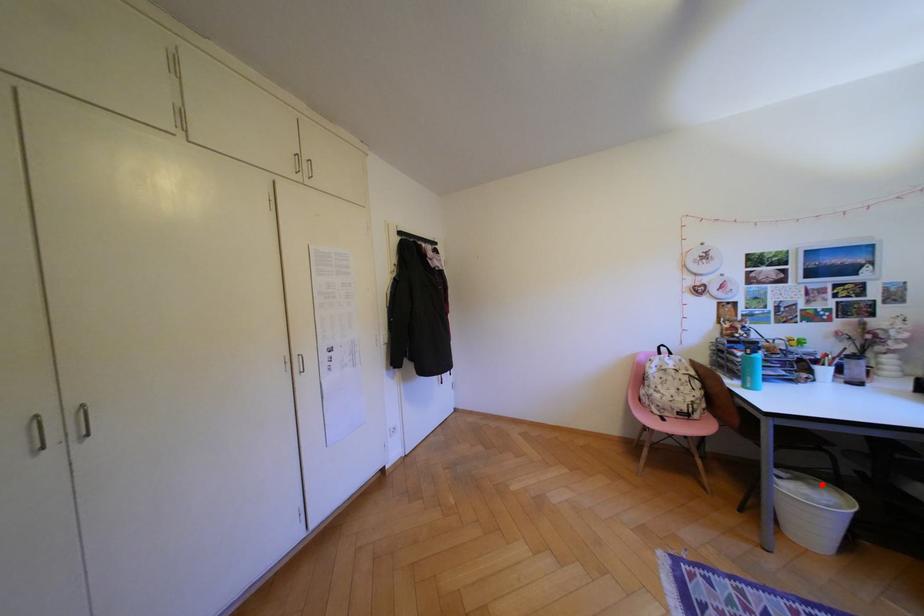
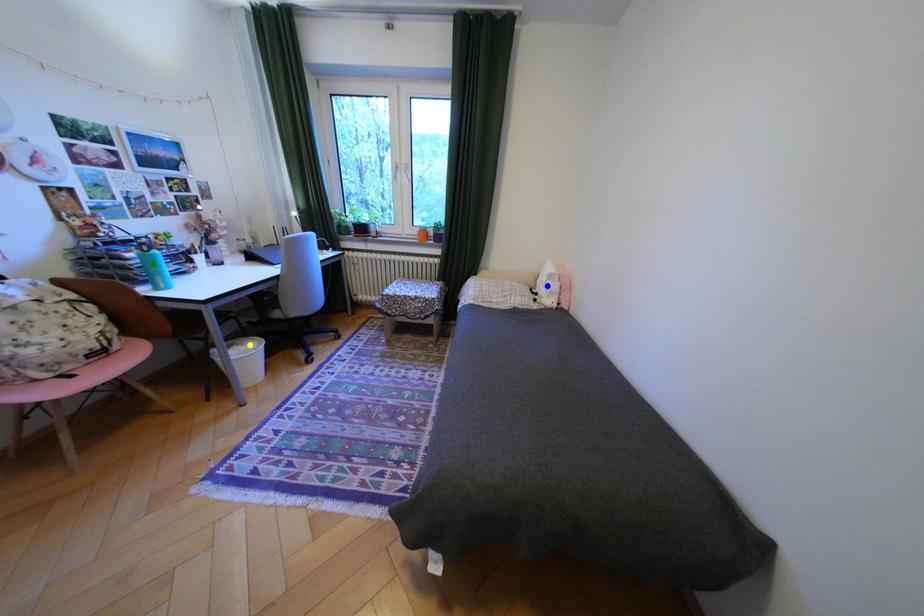
Question: I am providing you with two images of the same scene from different viewpoints. A red point is marked on the first image. You are given multiple points on the second image. Which spot in image 2 lines up with the point in image 1?

Choices:
 (A) green point
 (B) yellow point
 (C) blue point

Answer: (B)